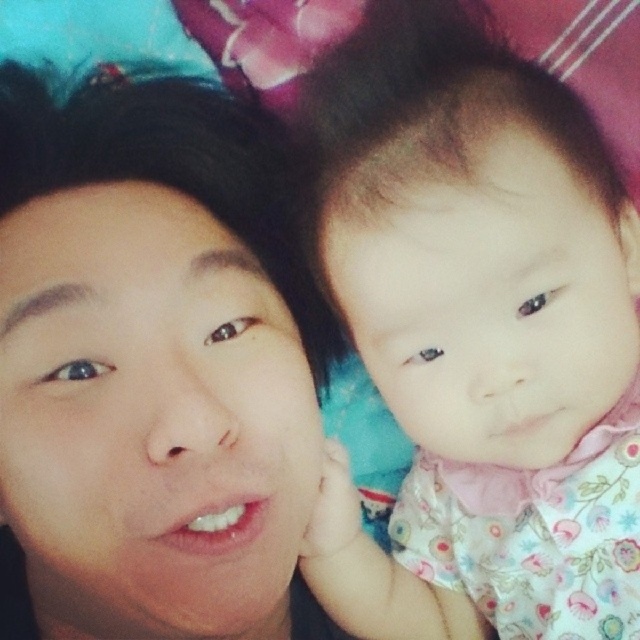
Does fluffy pink dress at upper right appear on the left side of smooth skin face at center?

No, fluffy pink dress at upper right is not to the left of smooth skin face at center.

How much distance is there between fluffy pink dress at upper right and smooth skin face at center?

fluffy pink dress at upper right is 15.01 centimeters away from smooth skin face at center.

The height and width of the screenshot is (640, 640). What do you see at coordinates (477, 339) in the screenshot?
I see `fluffy pink dress at upper right` at bounding box center [477, 339].

Identify the location of fluffy pink dress at upper right. (477, 339).